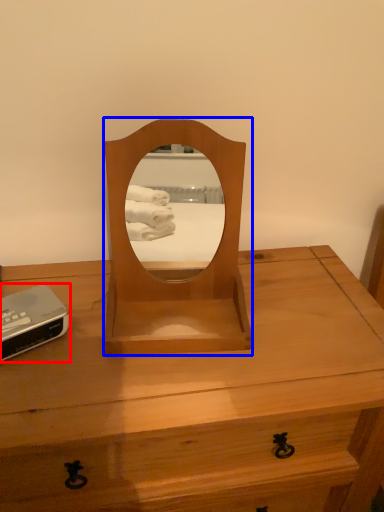
Question: Among these objects, which one is farthest to the camera, gadget (highlighted by a red box) or mirror (highlighted by a blue box)?

Choices:
 (A) gadget
 (B) mirror

Answer: (A)